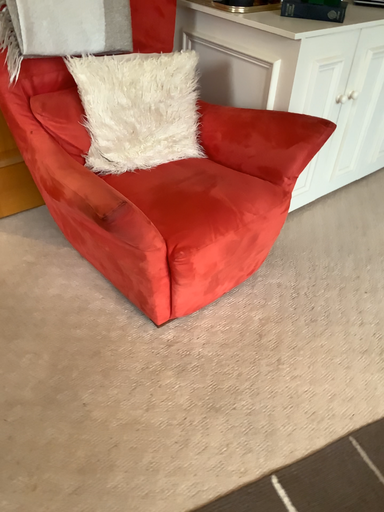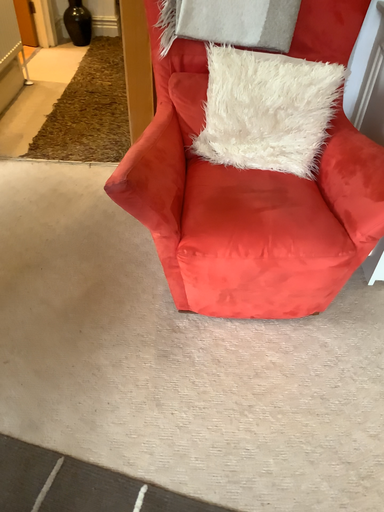
Question: How did the camera likely rotate when shooting the video?

Choices:
 (A) rotated right
 (B) rotated left

Answer: (B)